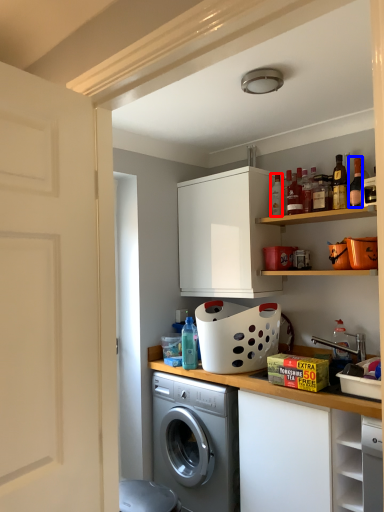
Question: Which point is closer to the camera, bottle (highlighted by a red box) or bottle (highlighted by a blue box)?

Choices:
 (A) bottle
 (B) bottle

Answer: (B)